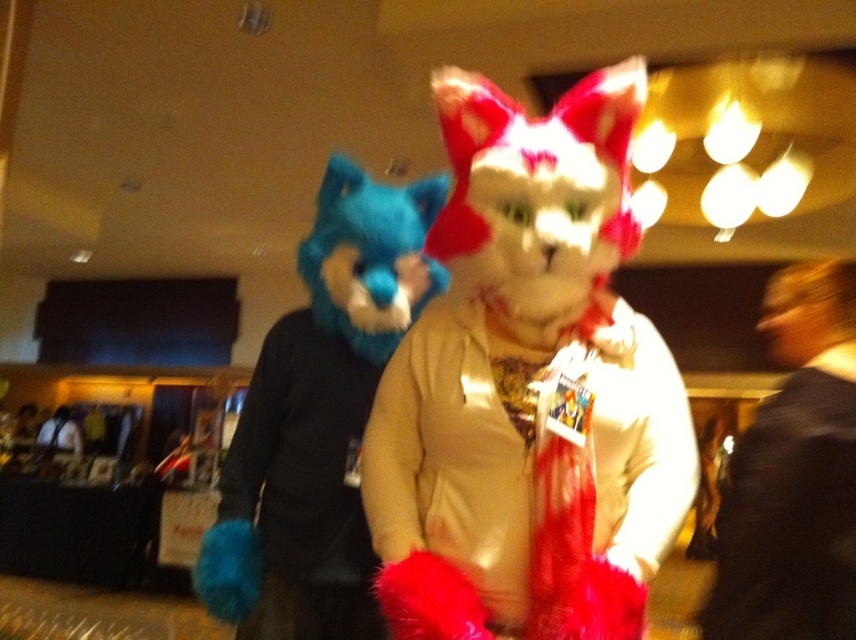
You are a photographer at a costume event and need to capture both the fuzzy white scarf at center and the black fuzzy coat at right in a single shot. Can you focus on both objects clearly without adjusting your camera settings?

The fuzzy white scarf at center is closer to the viewer than the black fuzzy coat at right, so focusing on both clearly in one shot may be challenging without adjusting the camera settings to increase the depth of field.

From the picture: You are a photographer at the event and want to capture a photo of the two costumed individuals. The fuzzy white scarf at center is in the way of the perfect shot. Where should you move to avoid it?

Move to the left or right of the fuzzy white scarf at center located at point (525,476) to avoid it in the photo.